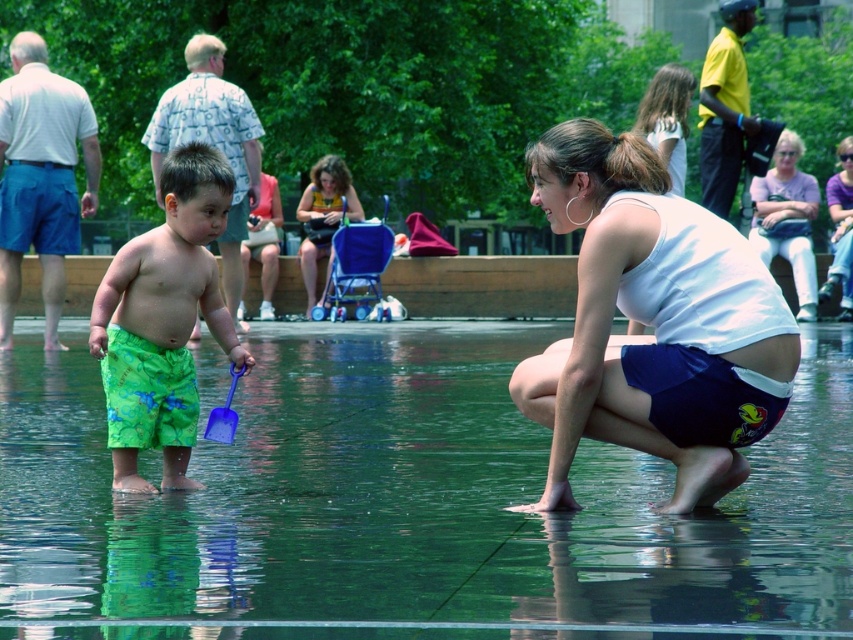
Question: Does green glossy water at center appear over green fabric shorts at left?

Choices:
 (A) yes
 (B) no

Answer: (B)

Question: Observing the image, what is the correct spatial positioning of green swim trunks at center in reference to matte yellow tank top at center?

Choices:
 (A) below
 (B) above

Answer: (A)

Question: Which point appears closest to the camera in this image?

Choices:
 (A) (775, 294)
 (B) (329, 257)
 (C) (206, 134)
 (D) (804, 195)

Answer: (A)

Question: Which point is farther to the camera?

Choices:
 (A) tap(674, 193)
 (B) tap(578, 170)
 (C) tap(22, 160)

Answer: (C)

Question: Does green swim trunks at left come behind blue plastic shovel at lower center?

Choices:
 (A) yes
 (B) no

Answer: (A)

Question: Which object is the farthest from the green swim trunks at left?

Choices:
 (A) green swim trunks at center
 (B) pink fabric purse at upper right

Answer: (A)